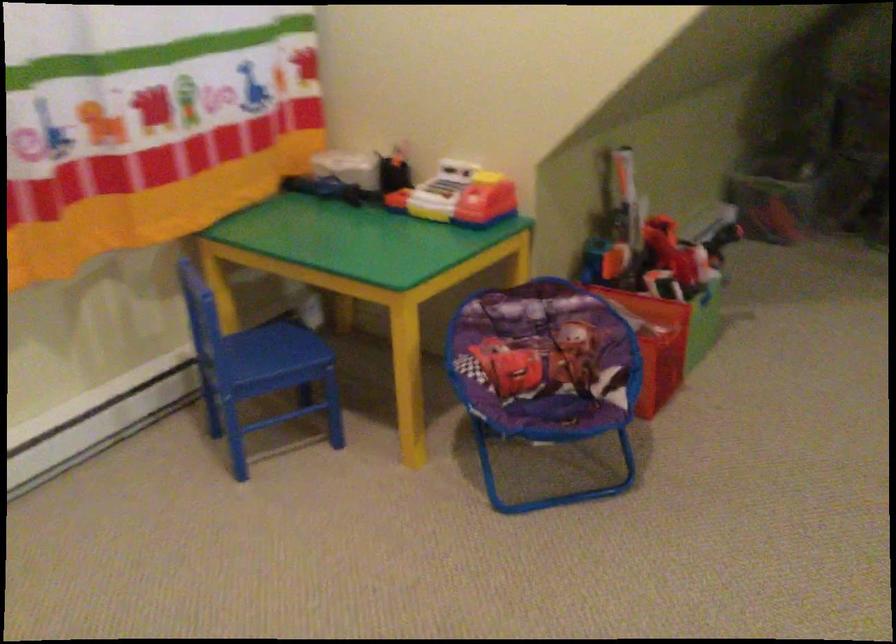
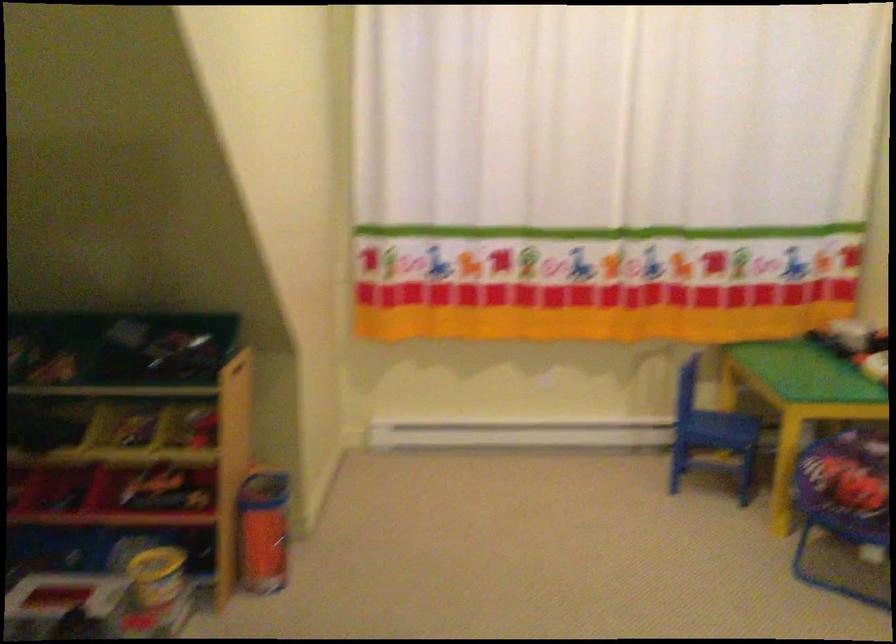
In the second image, find the point that corresponds to [279,359] in the first image.

(718, 430)